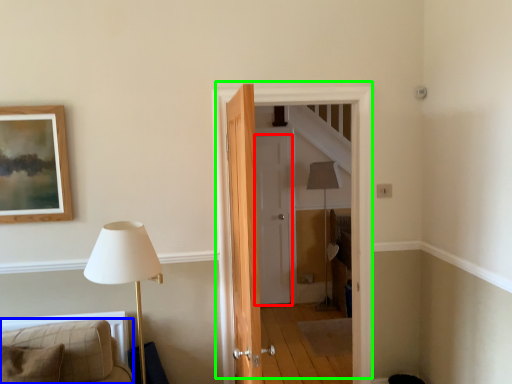
Question: Which object is positioned farthest from door (highlighted by a red box)? Select from furniture (highlighted by a blue box) and door (highlighted by a green box).

Choices:
 (A) furniture
 (B) door

Answer: (A)